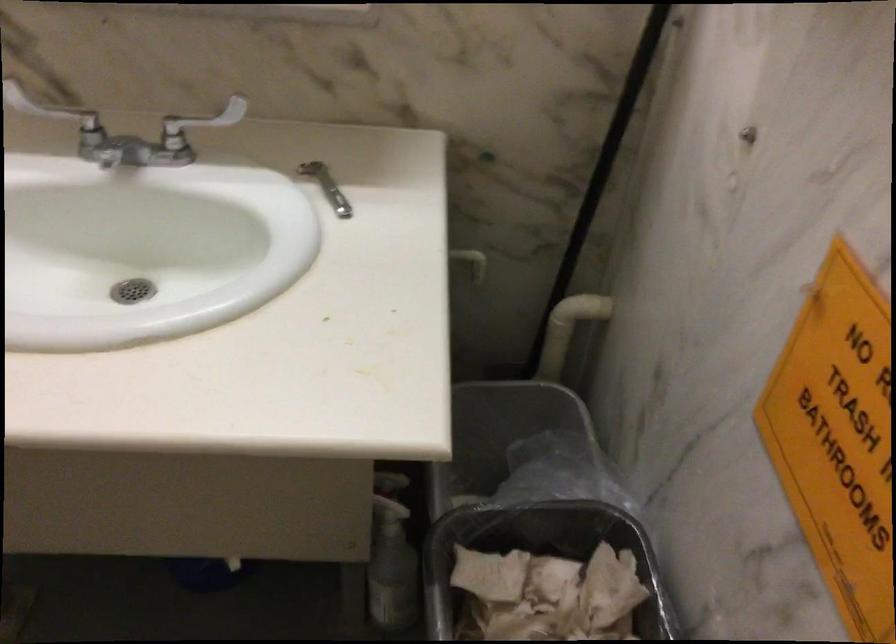
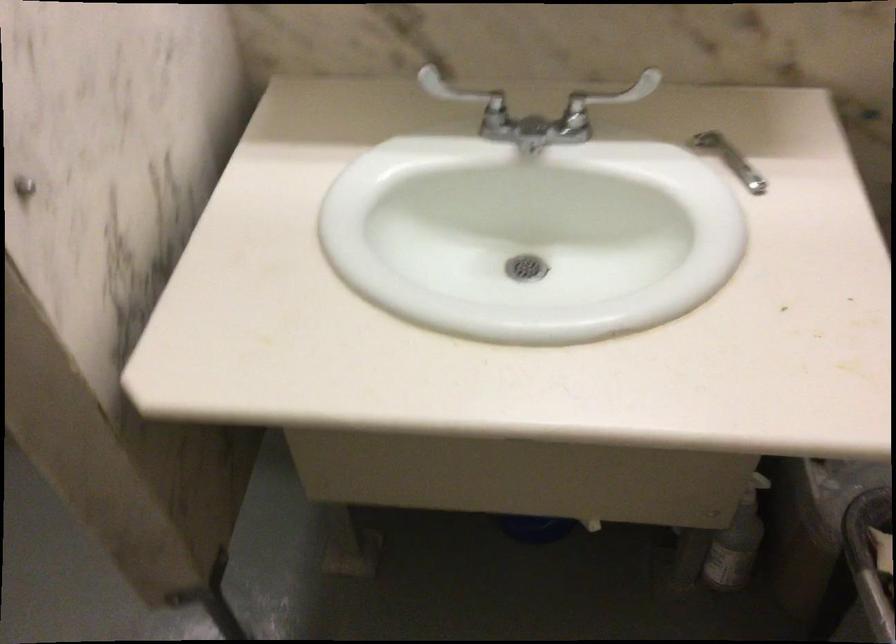
Find the pixel in the second image that matches (235,131) in the first image.

(608, 98)